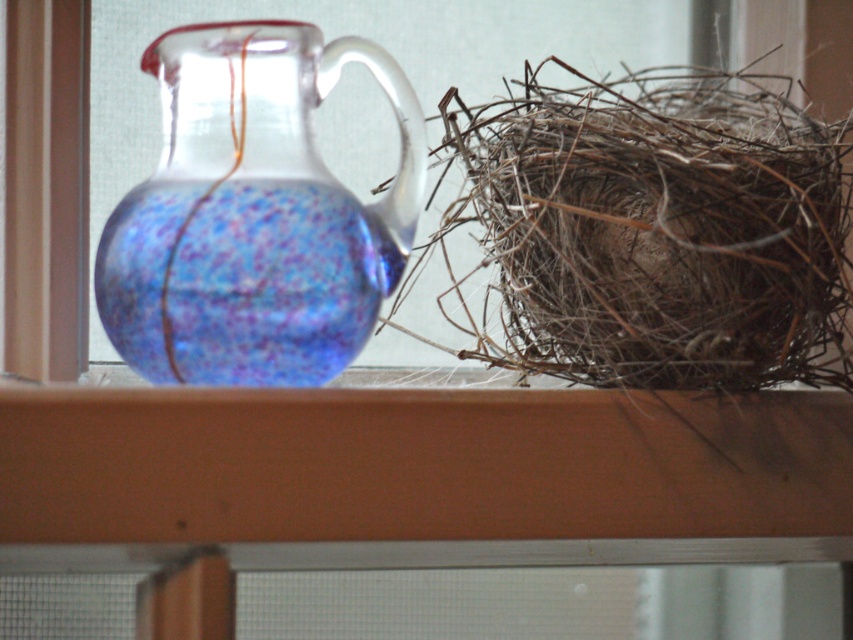
Find the location of a particular element. brown twigs nest at right is located at coordinates (654, 230).

Who is more distant from viewer, (x=653, y=106) or (x=142, y=228)?

The point (x=653, y=106) is more distant.

Between point (503, 314) and point (265, 211), which one is positioned in front?

Point (265, 211) is more forward.

You are a GUI agent. You are given a task and a screenshot of the screen. Output one action in this format:
    pyautogui.click(x=<x>, y=<y>)
    Task: Click on the brown twigs nest at right
    The image size is (853, 640).
    Given the screenshot: What is the action you would take?
    tap(654, 230)